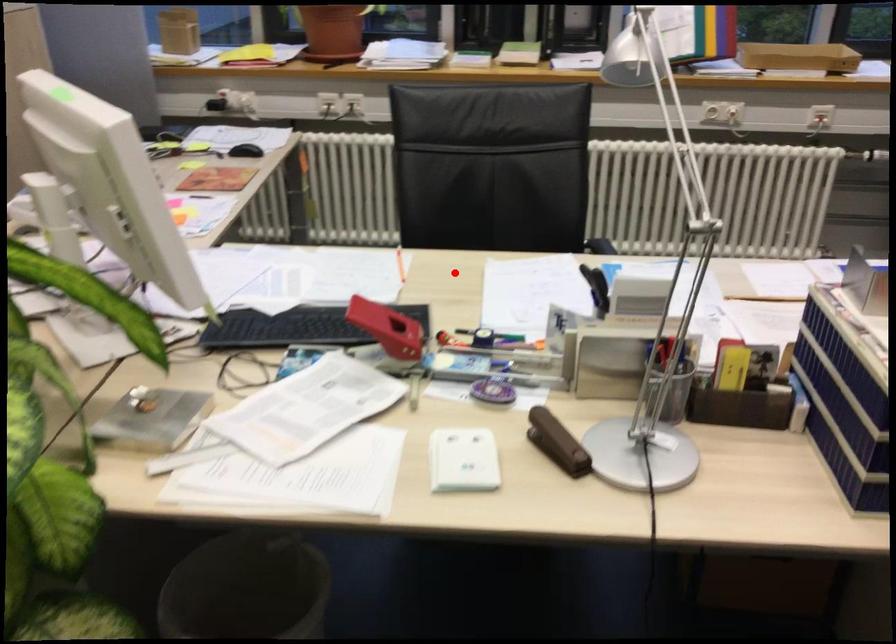
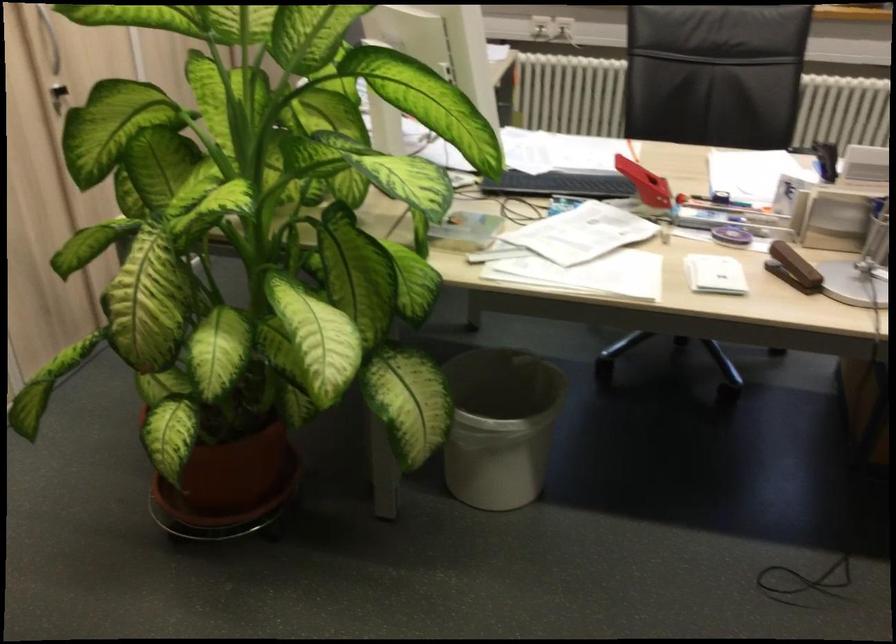
Find the pixel in the second image that matches the highlighted location in the first image.

(676, 158)